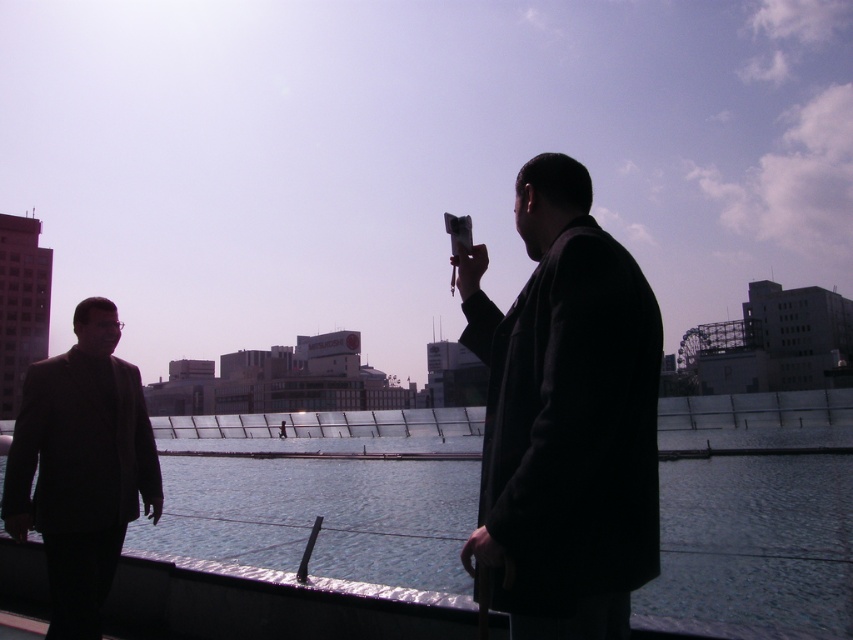
Can you confirm if glossy concrete water at center is smaller than matte black suit at left?

No, glossy concrete water at center is not smaller than matte black suit at left.

Does glossy concrete water at center come in front of matte black suit at left?

Yes, glossy concrete water at center is closer to the viewer.

Which is in front, point (434, 531) or point (35, 419)?

Point (35, 419)

Where is `glossy concrete water at center`? glossy concrete water at center is located at coordinates (320, 513).

Is dark matte coat at right further to the viewer compared to glossy concrete water at center?

No, it is not.

Which of these two, dark matte coat at right or glossy concrete water at center, stands shorter?

Standing shorter between the two is dark matte coat at right.

In the scene shown: Measure the distance between point (604,630) and camera.

Point (604,630) is 1.99 meters away from camera.

At what (x,y) coordinates should I click in order to perform the action: click on dark matte coat at right. Please return your answer as a coordinate pair (x, y). Image resolution: width=853 pixels, height=640 pixels. Looking at the image, I should click on (566, 417).

Does dark matte coat at right have a lesser width compared to matte black suit at left?

No.

Can you confirm if dark matte coat at right is positioned to the left of matte black suit at left?

In fact, dark matte coat at right is to the right of matte black suit at left.

The height and width of the screenshot is (640, 853). Describe the element at coordinates (566, 417) in the screenshot. I see `dark matte coat at right` at that location.

Identify the location of dark matte coat at right. The image size is (853, 640). (566, 417).